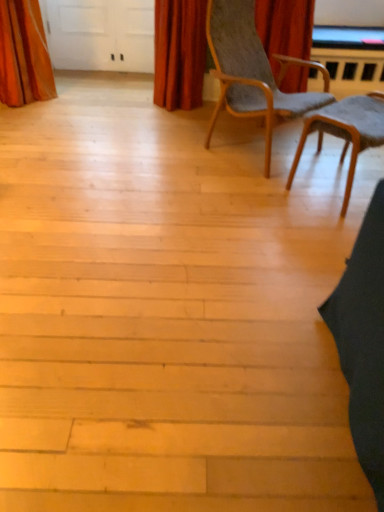
Locate an element on the screen. vacant area situated below light brown wood chair at center, marked as the first chair in a left-to-right arrangement (from a real-world perspective) is located at coordinates (258, 147).